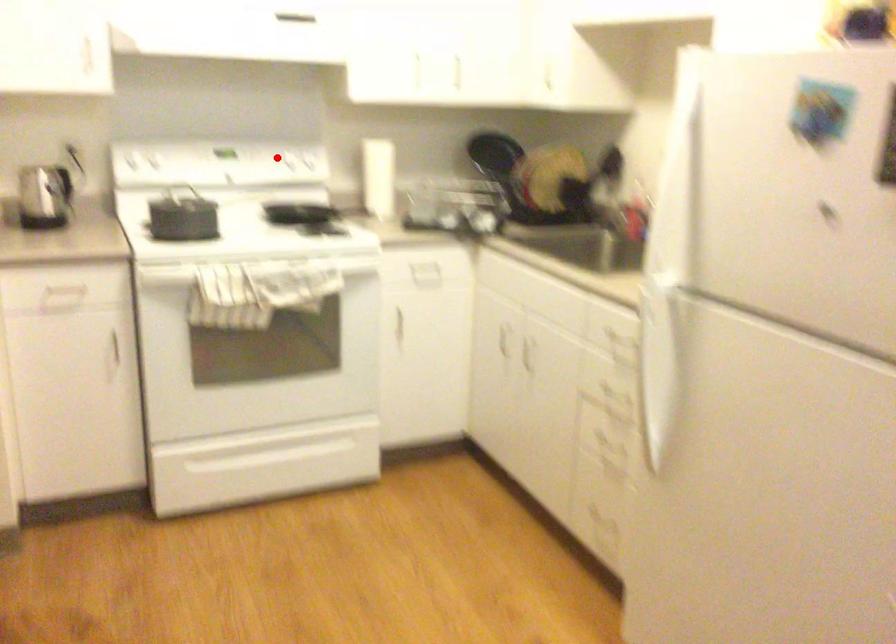
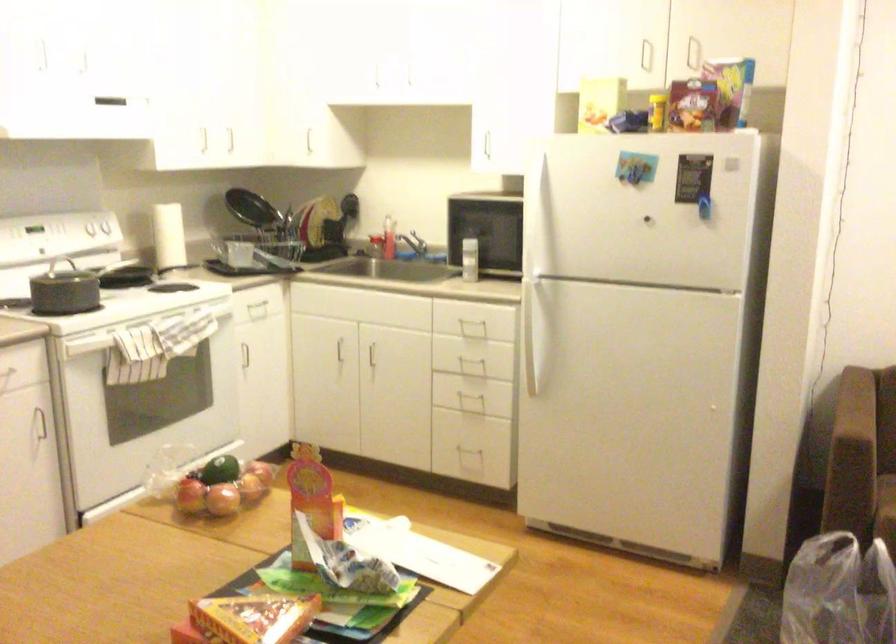
Where in the second image is the point corresponding to the highlighted location from the first image?

(98, 232)